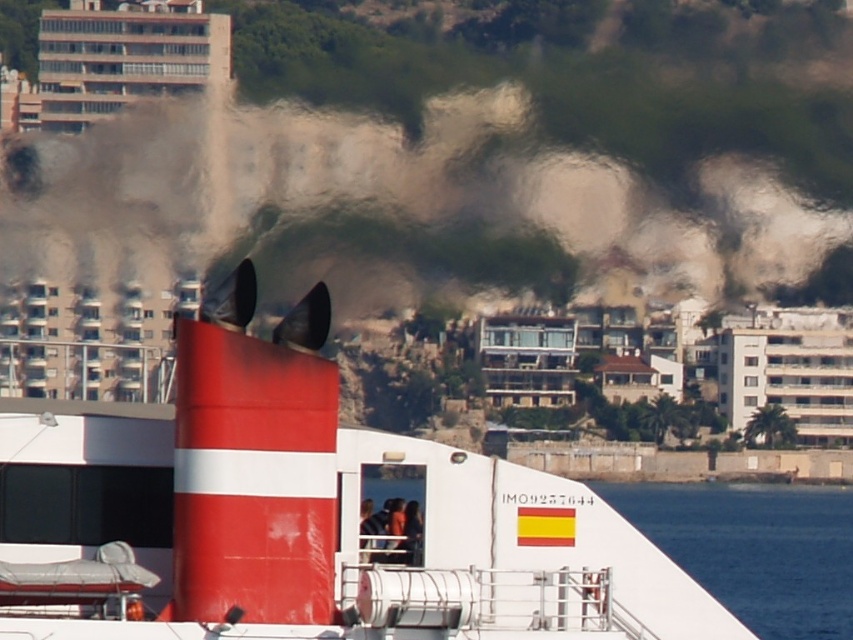
Who is shorter, smooth red and white boat at center or white glossy water at lower right?

smooth red and white boat at center

What are the coordinates of `smooth red and white boat at center` in the screenshot? It's located at (303, 516).

Does black matte smoke at upper center have a smaller size compared to white glossy water at lower right?

Indeed, black matte smoke at upper center has a smaller size compared to white glossy water at lower right.

Identify the location of black matte smoke at upper center. (405, 209).

What do you see at coordinates (405, 209) in the screenshot? I see `black matte smoke at upper center` at bounding box center [405, 209].

Identify the location of black matte smoke at upper center. This screenshot has width=853, height=640. [405, 209].

Which is in front, point (276, 630) or point (595, 221)?

Point (276, 630) is in front.

Does smooth red and white boat at center have a greater height compared to black matte smoke at upper center?

No, smooth red and white boat at center is not taller than black matte smoke at upper center.

Is point (395, 577) behind point (244, 132)?

That is False.

Locate an element on the screen. The height and width of the screenshot is (640, 853). smooth red and white boat at center is located at coordinates (303, 516).